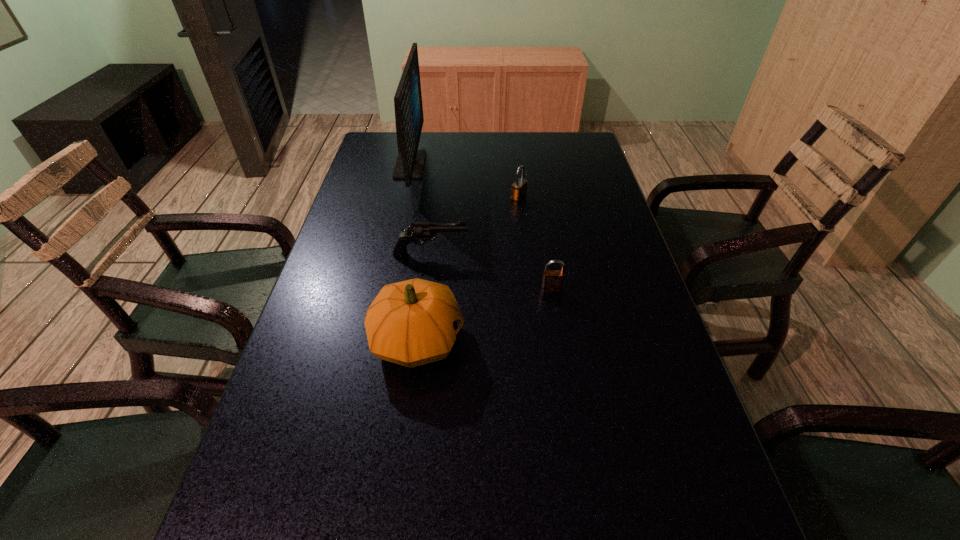
Identify the location of object that is the second closest to the tallest object. (519, 188).

You are a GUI agent. You are given a task and a screenshot of the screen. Output one action in this format:
    pyautogui.click(x=<x>, y=<y>)
    Task: Click on the closest padlock to the computer monitor
    The image size is (960, 540).
    Given the screenshot: What is the action you would take?
    pyautogui.click(x=519, y=188)

Image resolution: width=960 pixels, height=540 pixels. Identify the location of padlock that is the closest to the fourth shortest object. (553, 280).

Locate an element on the screen. The image size is (960, 540). vacant space that satisfies the following two spatial constraints: 1. on the front side of the fourth object from left to right; 2. at the end of the barrel of the gun is located at coordinates (525, 254).